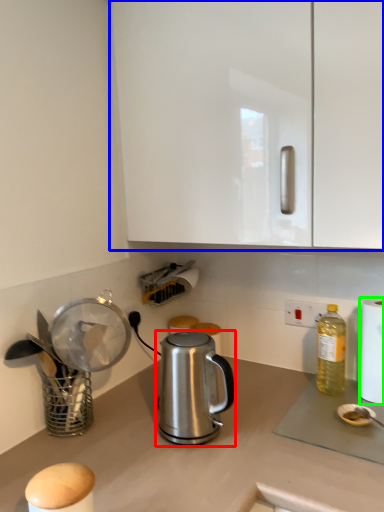
Question: Which is farther away from kettle (highlighted by a red box)? cabinetry (highlighted by a blue box) or paper towel (highlighted by a green box)?

Choices:
 (A) cabinetry
 (B) paper towel

Answer: (A)